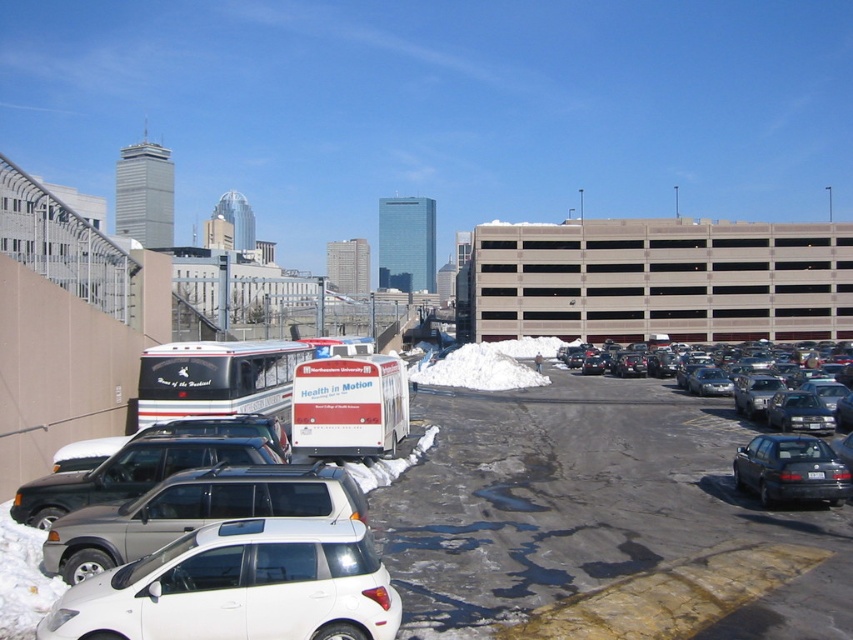
Question: Which point is closer to the camera?

Choices:
 (A) (817, 424)
 (B) (276, 500)
 (C) (152, 477)

Answer: (B)

Question: Can you confirm if white matte hatchback at center is positioned below black glossy sedan at center right?

Choices:
 (A) yes
 (B) no

Answer: (B)

Question: Is white matte hatchback at lower left wider than dark gray metallic sedan at lower right?

Choices:
 (A) yes
 (B) no

Answer: (A)

Question: Which point is closer to the camera?

Choices:
 (A) white matte hatchback at center
 (B) white matte hatchback at lower left

Answer: (B)

Question: Does white matte van at center appear on the right side of black glossy sedan at right?

Choices:
 (A) yes
 (B) no

Answer: (B)

Question: Which point is farther to the camera?

Choices:
 (A) white matte hatchback at center
 (B) white matte van at center
 (C) black glossy sedan at center right
 (D) white matte hatchback at lower left

Answer: (C)